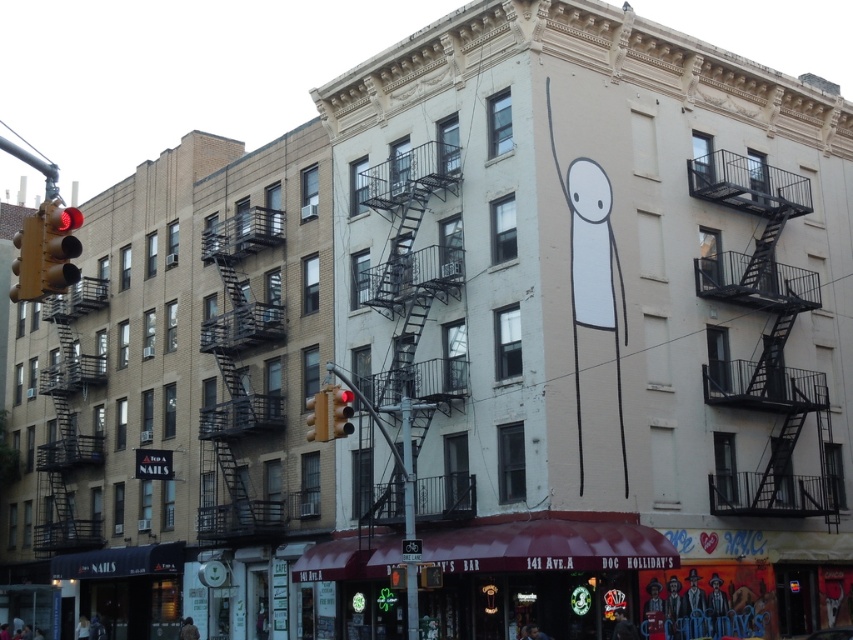
You are a pedestrian standing on the sidewalk in front of the building. You see the black metal fire escape at right and the metallic yellow traffic light at left. Which object is located to the right of the other?

The black metal fire escape at right is positioned on the right side of metallic yellow traffic light at left, so the fire escape is to the right of the traffic light.

You are a city planner reviewing a design for a new intersection. The design includes both a metallic yellow traffic light at center and a red glass traffic light at center. Based on the provided image, which traffic light is taller?

The metallic yellow traffic light at center is taller than the red glass traffic light at center according to the description.

In the scene shown: You are a pedestrian standing at the intersection and see both the metallic yellow traffic light at left and the red glass traffic light at center. Which traffic light is located more to the left?

The metallic yellow traffic light at left is more to the left than the red glass traffic light at center.